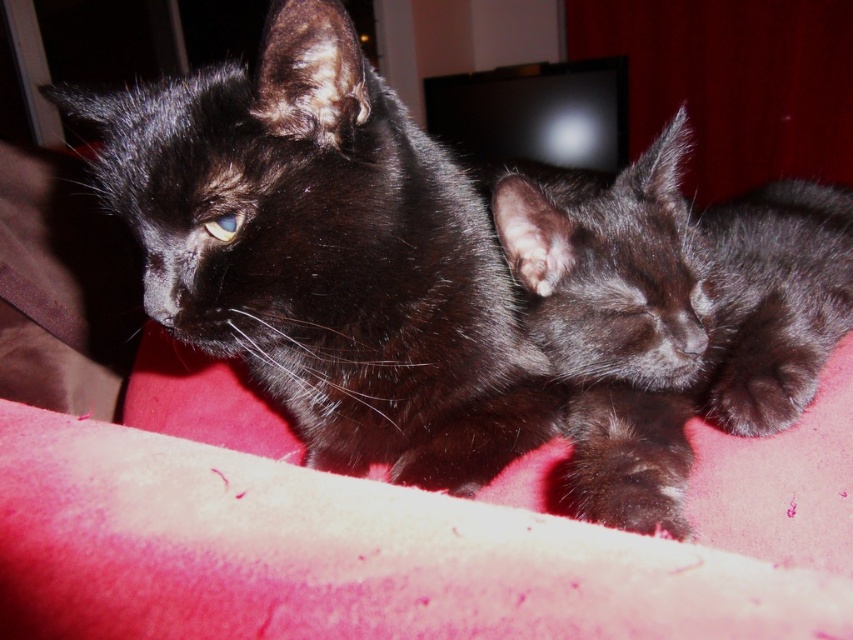
Question: In this image, where is shiny black cat at upper left located relative to shiny black kitten at center?

Choices:
 (A) above
 (B) below

Answer: (B)

Question: Is shiny black cat at upper left positioned behind shiny black kitten at center?

Choices:
 (A) yes
 (B) no

Answer: (A)

Question: Which point is closer to the camera?

Choices:
 (A) shiny black kitten at center
 (B) shiny black cat at upper left

Answer: (A)

Question: Does shiny black cat at upper left appear under shiny black kitten at center?

Choices:
 (A) yes
 (B) no

Answer: (A)

Question: Among these objects, which one is farthest from the camera?

Choices:
 (A) shiny black kitten at center
 (B) shiny black cat at upper left

Answer: (B)